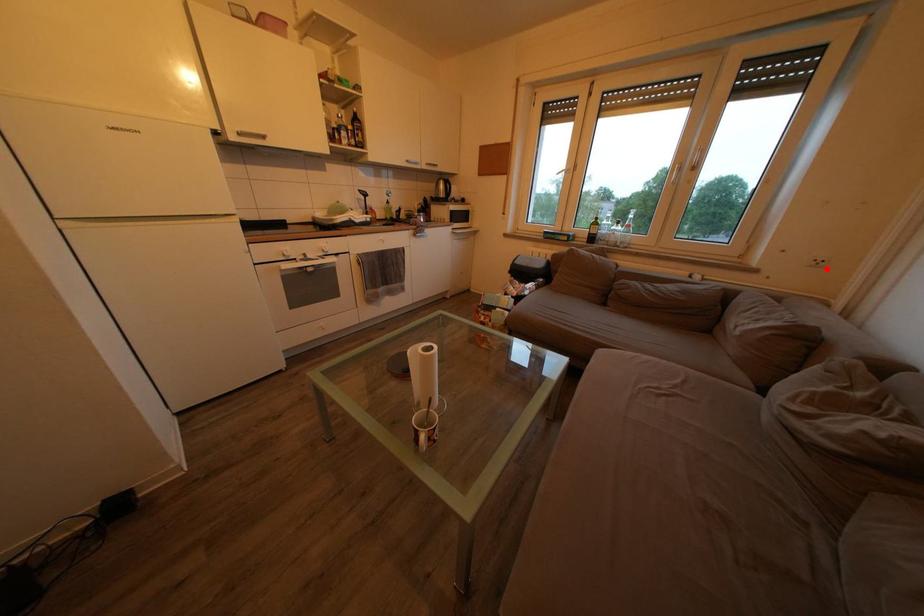
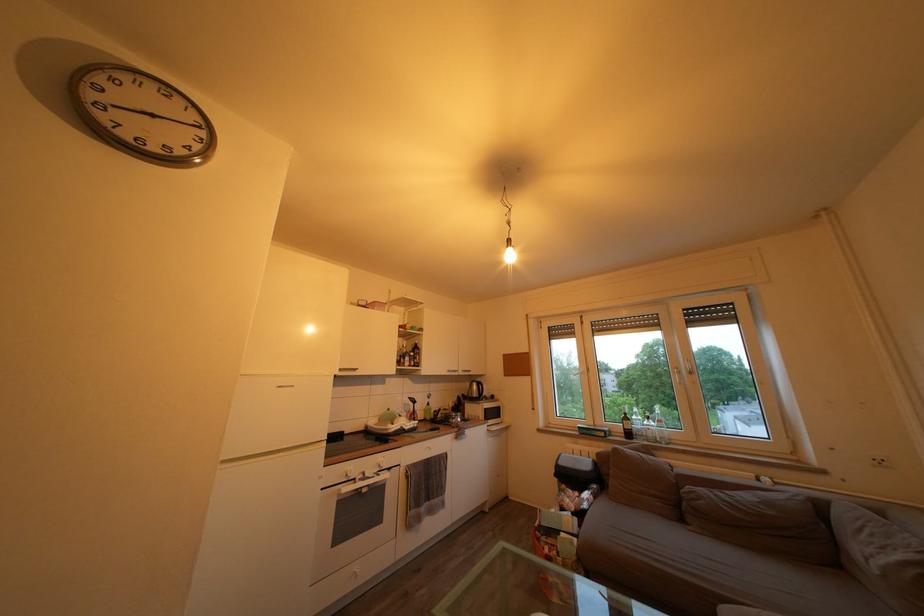
Where in the second image is the point corresponding to the highlighted location from the first image?

(889, 468)